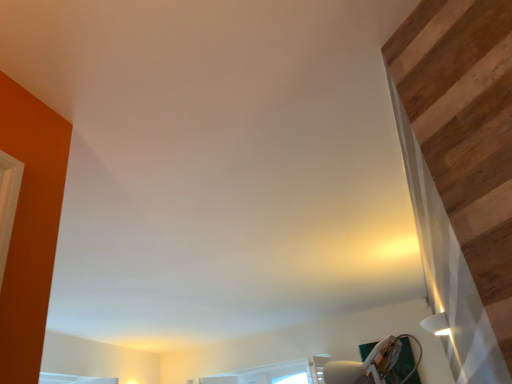
What do you see at coordinates (436, 324) in the screenshot? I see `white glossy lampshade at lower right` at bounding box center [436, 324].

The height and width of the screenshot is (384, 512). Identify the location of white glossy lampshade at lower right. (436, 324).

This screenshot has height=384, width=512. Identify the location of white glossy lampshade at lower right. (436, 324).